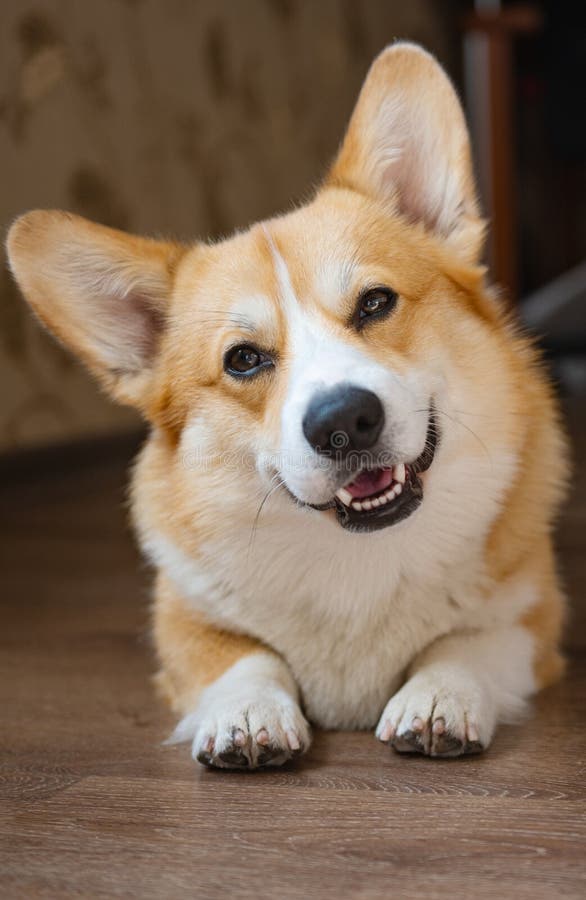
Find the location of a particular element. The image size is (586, 900). wooden floor is located at coordinates (73, 696).